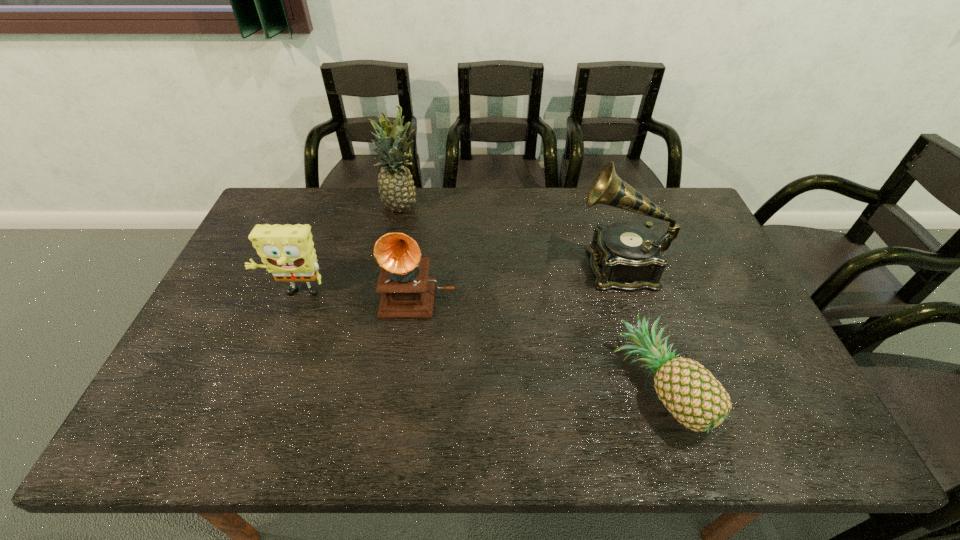
Identify the location of vacant point located on the horn of the right phonograph record. (507, 266).

Locate an element on the screen. The image size is (960, 540). blank space located on the horn of the left phonograph record is located at coordinates (407, 388).

This screenshot has height=540, width=960. I want to click on blank area located on the face of the sponge, so click(249, 414).

You are a GUI agent. You are given a task and a screenshot of the screen. Output one action in this format:
    pyautogui.click(x=<x>, y=<y>)
    Task: Click on the free space located on the back of the nearest object
    
    Given the screenshot: What is the action you would take?
    click(612, 241)

Identify the location of object that is at the far edge. (396, 188).

In order to click on object that is at the near edge in this screenshot , I will do `click(689, 391)`.

The width and height of the screenshot is (960, 540). I want to click on object that is at the left edge, so click(x=287, y=251).

Where is `vacant region at the far edge of the desktop`? The image size is (960, 540). vacant region at the far edge of the desktop is located at coordinates (415, 210).

Where is `vacant space at the near edge`? Image resolution: width=960 pixels, height=540 pixels. vacant space at the near edge is located at coordinates (533, 444).

Locate an element on the screen. Image resolution: width=960 pixels, height=540 pixels. vacant space at the left edge is located at coordinates (252, 231).